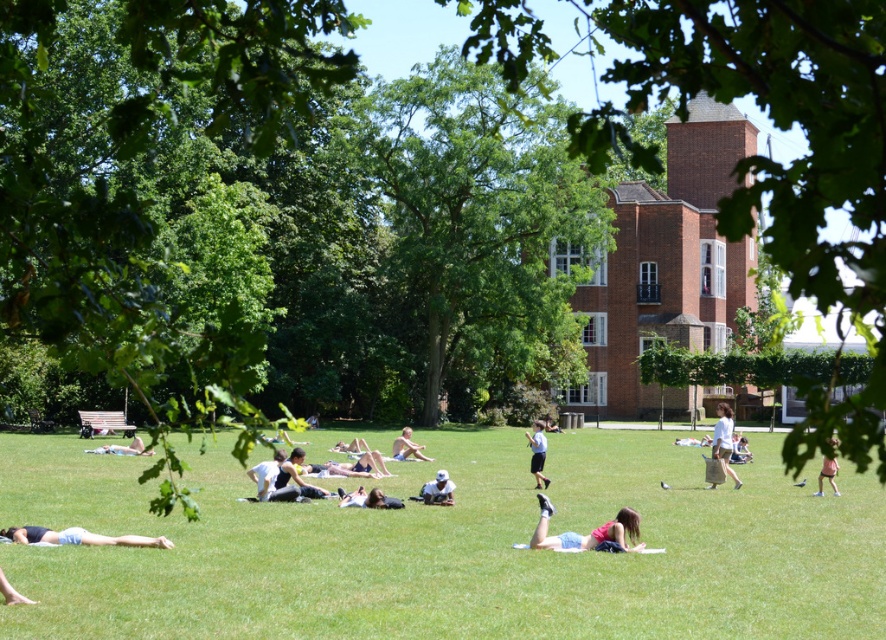
Question: Considering the relative positions of white fabric bag at right and pink fabric shorts at lower right in the image provided, where is white fabric bag at right located with respect to pink fabric shorts at lower right?

Choices:
 (A) left
 (B) right

Answer: (B)

Question: Which is farther from the matte black shorts at lower left?

Choices:
 (A) dark gray fabric at center
 (B) smooth beige foot at lower left
 (C) light blue fabric shirt at center
 (D) green leafy tree at left

Answer: (C)

Question: Is green grass at center positioned before matte black laptop at lower left?

Choices:
 (A) no
 (B) yes

Answer: (B)

Question: Which point is farther to the camera?

Choices:
 (A) (109, 544)
 (B) (593, 538)

Answer: (B)

Question: Which point is closer to the camera?

Choices:
 (A) (626, 525)
 (B) (416, 458)
 (C) (157, 538)
 (D) (12, 589)

Answer: (D)

Question: Can you confirm if matte black laptop at lower left is positioned to the right of pink fabric shorts at lower right?

Choices:
 (A) no
 (B) yes

Answer: (A)